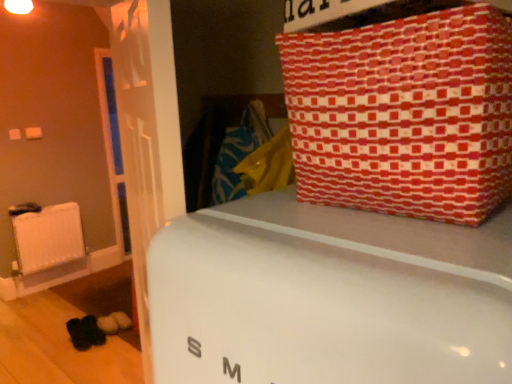
Question: Is red patterned fabric at upper right placed right next to white matte radiator at left?

Choices:
 (A) no
 (B) yes

Answer: (A)

Question: Considering the relative sizes of red patterned fabric at upper right and white matte radiator at left in the image provided, is red patterned fabric at upper right thinner than white matte radiator at left?

Choices:
 (A) yes
 (B) no

Answer: (B)

Question: Is red patterned fabric at upper right positioned before white matte radiator at left?

Choices:
 (A) no
 (B) yes

Answer: (B)

Question: Is white matte radiator at left at the back of red patterned fabric at upper right?

Choices:
 (A) yes
 (B) no

Answer: (B)

Question: From the image's perspective, is red patterned fabric at upper right beneath white matte radiator at left?

Choices:
 (A) no
 (B) yes

Answer: (A)

Question: Does red patterned fabric at upper right appear on the right side of white matte radiator at left?

Choices:
 (A) yes
 (B) no

Answer: (A)

Question: Does red patterned fabric at upper right have a greater width compared to white glossy refrigerator at center?

Choices:
 (A) yes
 (B) no

Answer: (B)

Question: Can you confirm if red patterned fabric at upper right is positioned to the right of white glossy refrigerator at center?

Choices:
 (A) no
 (B) yes

Answer: (B)

Question: Is red patterned fabric at upper right looking in the opposite direction of white glossy refrigerator at center?

Choices:
 (A) yes
 (B) no

Answer: (B)

Question: Can white glossy refrigerator at center be found inside red patterned fabric at upper right?

Choices:
 (A) yes
 (B) no

Answer: (B)

Question: Considering the relative positions of red patterned fabric at upper right and white glossy refrigerator at center in the image provided, is red patterned fabric at upper right to the left of white glossy refrigerator at center from the viewer's perspective?

Choices:
 (A) no
 (B) yes

Answer: (A)

Question: Considering the relative sizes of red patterned fabric at upper right and white glossy refrigerator at center in the image provided, is red patterned fabric at upper right thinner than white glossy refrigerator at center?

Choices:
 (A) no
 (B) yes

Answer: (B)

Question: Does white glossy refrigerator at center appear on the left side of white matte radiator at left?

Choices:
 (A) yes
 (B) no

Answer: (B)